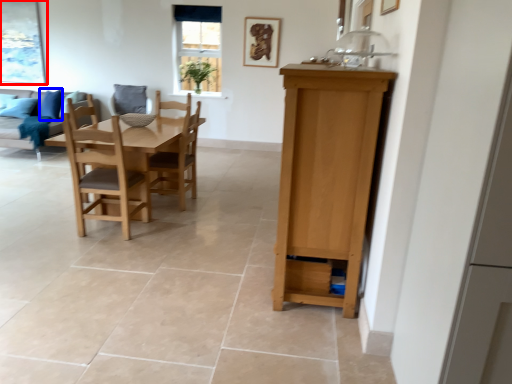
Question: Which object appears closest to the camera in this image, picture frame (highlighted by a red box) or pillow (highlighted by a blue box)?

Choices:
 (A) picture frame
 (B) pillow

Answer: (B)